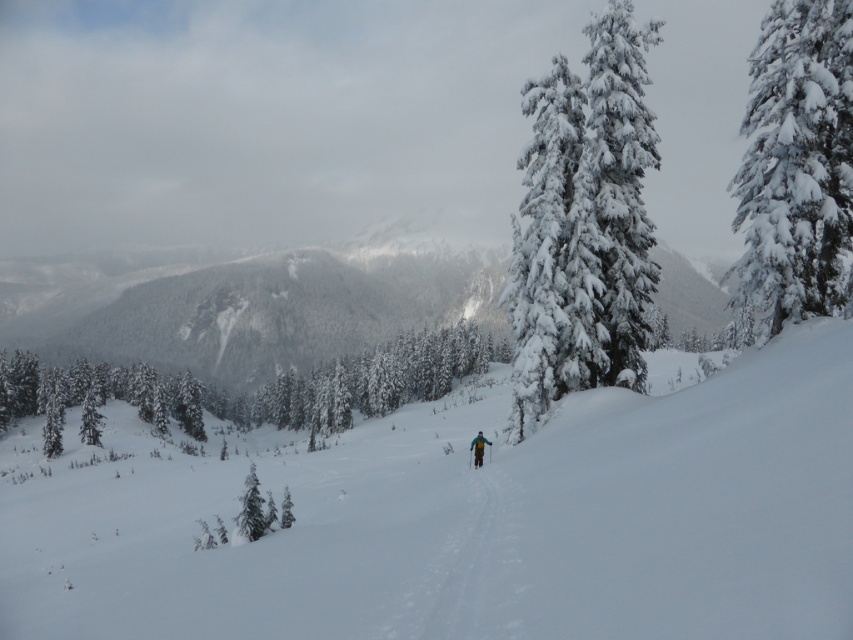
Is snow-covered evergreen at right shorter than teal fabric jacket at center?

No, snow-covered evergreen at right is not shorter than teal fabric jacket at center.

Does snow-covered evergreen at right have a larger size compared to teal fabric jacket at center?

Correct, snow-covered evergreen at right is larger in size than teal fabric jacket at center.

The image size is (853, 640). Find the location of `snow-covered evergreen at right`. snow-covered evergreen at right is located at coordinates (796, 161).

Who is lower down, white snow ski slope at center or teal fabric jacket at center?

white snow ski slope at center is lower down.

Looking at this image, is the position of white snow ski slope at center less distant than that of teal fabric jacket at center?

Yes.

What do you see at coordinates (461, 516) in the screenshot? I see `white snow ski slope at center` at bounding box center [461, 516].

Find the location of `white snow ski slope at center`. white snow ski slope at center is located at coordinates (461, 516).

Is snow-covered evergreen at center taller than snow-covered evergreen at right?

Yes.

Is point (526, 88) positioned before point (756, 273)?

That is False.

The height and width of the screenshot is (640, 853). In order to click on snow-covered evergreen at center in this screenshot , I will do `click(584, 221)`.